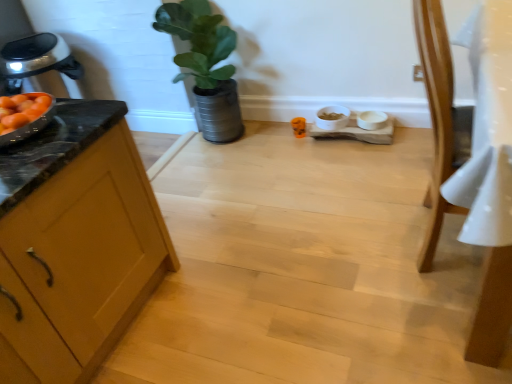
Identify the location of free space in front of light brown wooden chair at right. (431, 324).